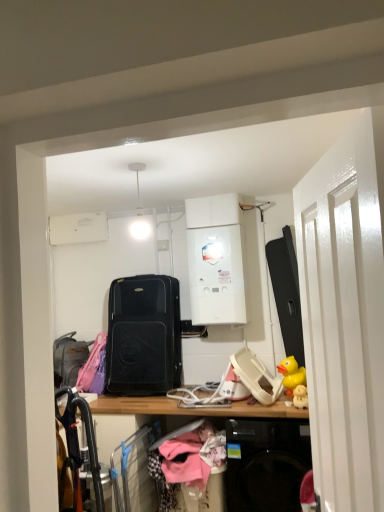
This screenshot has width=384, height=512. Find the location of `wooden desk at center`. wooden desk at center is located at coordinates (265, 455).

The width and height of the screenshot is (384, 512). What do you see at coordinates (178, 433) in the screenshot? I see `pink fabric hanger at center` at bounding box center [178, 433].

Describe the element at coordinates (143, 336) in the screenshot. This screenshot has height=512, width=384. I see `black matte suitcase at center` at that location.

At what (x,y) coordinates should I click in order to perform the action: click on white glossy boiler at center. Please return your answer as a coordinate pair (x, y). This screenshot has height=512, width=384. Looking at the image, I should click on (216, 275).

Where is `toy to the right of pink fabric hanger at center`? toy to the right of pink fabric hanger at center is located at coordinates (292, 374).

Is point (202, 422) positioned in front of point (301, 383)?

No, (202, 422) is further to viewer.

Looking at this image, who is bigger, pink fabric hanger at center or yellow rubber duck at right?

With larger size is pink fabric hanger at center.

Is pink fabric hanger at center situated inside yellow rubber duck at right or outside?

pink fabric hanger at center lies outside yellow rubber duck at right.

Does white glossy boiler at center appear on the right side of wooden desk at center?

Yes.

From a real-world perspective, which is physically below, white glossy boiler at center or wooden desk at center?

In real-world perspective, wooden desk at center is lower.

Based on the photo, from the image's perspective, between white glossy boiler at center and wooden desk at center, which one is located above?

white glossy boiler at center, from the image's perspective.

In terms of width, does white glossy boiler at center look wider or thinner when compared to wooden desk at center?

In the image, white glossy boiler at center appears to be more narrow than wooden desk at center.

Is black matte suitcase at center taller than pink fabric hanger at center?

Yes.

From a real-world perspective, is black matte suitcase at center located beneath pink fabric hanger at center?

No, from a real-world perspective, black matte suitcase at center is not below pink fabric hanger at center.

Can pink fabric hanger at center be found inside black matte suitcase at center?

Definitely not — pink fabric hanger at center is not inside black matte suitcase at center.

Who is smaller, black matte suitcase at center or pink fabric hanger at center?

Smaller between the two is pink fabric hanger at center.

How many degrees apart are the facing directions of yellow rubber duck at right and gray fabric suitcase at left?

37.7 degrees.

Is yellow rubber duck at right smaller than gray fabric suitcase at left?

Indeed, yellow rubber duck at right has a smaller size compared to gray fabric suitcase at left.

Is yellow rubber duck at right not within gray fabric suitcase at left?

Yes.

Can you confirm if yellow rubber duck at right is taller than gray fabric suitcase at left?

Incorrect, the height of yellow rubber duck at right is not larger of that of gray fabric suitcase at left.

Locate an element on the screen. The width and height of the screenshot is (384, 512). luggage below the white glossy boiler at center (from a real-world perspective) is located at coordinates (69, 359).

How distant is gray fabric suitcase at left from white glossy boiler at center?

gray fabric suitcase at left is 1.14 meters away from white glossy boiler at center.

Considering the relative sizes of gray fabric suitcase at left and white glossy boiler at center in the image provided, is gray fabric suitcase at left bigger than white glossy boiler at center?

Actually, gray fabric suitcase at left might be smaller than white glossy boiler at center.

Is gray fabric suitcase at left touching white glossy boiler at center?

They are not placed beside each other.

Is gray fabric suitcase at left oriented away from pink fabric hanger at center?

No, gray fabric suitcase at left is not facing away from pink fabric hanger at center.

From a real-world perspective, is gray fabric suitcase at left above or below pink fabric hanger at center?

gray fabric suitcase at left is above pink fabric hanger at center.

From the image's perspective, between gray fabric suitcase at left and pink fabric hanger at center, which one is located above?

From the image's view, gray fabric suitcase at left is above.

Could you tell me if white glossy door at right is turned towards white glossy boiler at center?

No, white glossy door at right is not facing towards white glossy boiler at center.

Consider the image. Can you confirm if white glossy door at right is positioned to the right of white glossy boiler at center?

Yes, white glossy door at right is to the right of white glossy boiler at center.

Image resolution: width=384 pixels, height=512 pixels. Identify the location of hanger on the left of yellow rubber duck at right. (178, 433).

Image resolution: width=384 pixels, height=512 pixels. In order to click on desk located in front of the white glossy boiler at center in this screenshot , I will do click(x=265, y=455).

Estimate the real-world distances between objects in this image. Which object is further from wooden desk at center, gray fabric suitcase at left or pink fabric hanger at center?

gray fabric suitcase at left is further to wooden desk at center.

From the image, which object appears to be farther from white glossy door at right, wooden desk at center or yellow rubber duck at right?

yellow rubber duck at right is positioned further to the anchor white glossy door at right.

When comparing their distances from gray fabric suitcase at left, does yellow rubber duck at right or wooden desk at center seem further?

The object further to gray fabric suitcase at left is yellow rubber duck at right.

When comparing their distances from white glossy door at right, does white glossy boiler at center or pink fabric hanger at center seem closer?

white glossy boiler at center lies closer to white glossy door at right than the other object.

Based on their spatial positions, is black matte suitcase at center or white glossy door at right further from pink fabric hanger at center?

white glossy door at right.

Considering their positions, is yellow rubber duck at right positioned further to white glossy door at right than wooden desk at center?

yellow rubber duck at right.

Based on their spatial positions, is pink fabric hanger at center or yellow rubber duck at right closer to wooden desk at center?

Among the two, pink fabric hanger at center is located nearer to wooden desk at center.

When comparing their distances from white glossy door at right, does pink fabric hanger at center or wooden desk at center seem closer?

wooden desk at center.

The image size is (384, 512). Find the location of `luggage and bags between gray fabric suitcase at left and white glossy boiler at center in the horizontal direction`. luggage and bags between gray fabric suitcase at left and white glossy boiler at center in the horizontal direction is located at coordinates (143, 336).

Locate an element on the screen. toy positioned between white glossy door at right and white glossy boiler at center from near to far is located at coordinates (292, 374).

In order to click on desk situated between pink fabric hanger at center and yellow rubber duck at right from left to right in this screenshot , I will do `click(265, 455)`.

Identify the location of desk positioned between white glossy door at right and white glossy boiler at center from near to far. (265, 455).